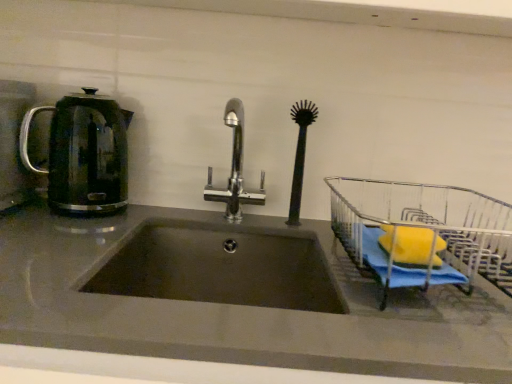
Identify the location of translucent glass kettle at left. The width and height of the screenshot is (512, 384). (83, 154).

Based on the photo, measure the distance between chrome metallic faucet at center and camera.

A distance of 38.13 inches exists between chrome metallic faucet at center and camera.

Image resolution: width=512 pixels, height=384 pixels. Describe the element at coordinates (234, 170) in the screenshot. I see `chrome metallic faucet at center` at that location.

The width and height of the screenshot is (512, 384). Describe the element at coordinates (300, 155) in the screenshot. I see `black rubber brush at center` at that location.

The image size is (512, 384). I want to click on translucent glass kettle at left, so click(x=83, y=154).

Consider the image. Is black rubber brush at center positioned before metallic wire dish rack at right?

No, the depth of black rubber brush at center is greater than that of metallic wire dish rack at right.

Is black rubber brush at center looking in the opposite direction of metallic wire dish rack at right?

black rubber brush at center is not turned away from metallic wire dish rack at right.

From the image's perspective, between black rubber brush at center and metallic wire dish rack at right, which one is located above?

black rubber brush at center is shown above in the image.

From a real-world perspective, is black rubber brush at center over metallic wire dish rack at right?

Yes, from a real-world perspective, black rubber brush at center is above metallic wire dish rack at right.

Is dark gray matte sink at center next to chrome metallic faucet at center?

They are not placed beside each other.

Is dark gray matte sink at center surrounding chrome metallic faucet at center?

Definitely not — chrome metallic faucet at center is not inside dark gray matte sink at center.

From the image's perspective, which object appears higher, dark gray matte sink at center or chrome metallic faucet at center?

chrome metallic faucet at center, from the image's perspective.

Does dark gray matte sink at center have a greater width compared to chrome metallic faucet at center?

Indeed, dark gray matte sink at center has a greater width compared to chrome metallic faucet at center.

Does point (304, 157) lie in front of point (95, 93)?

No, (304, 157) is further to viewer.

From the image's perspective, who appears lower, black rubber brush at center or translucent glass kettle at left?

black rubber brush at center, from the image's perspective.

Identify the location of brush that is behind the translucent glass kettle at left. (300, 155).

Looking at this image, is black rubber brush at center wider or thinner than translucent glass kettle at left?

Clearly, black rubber brush at center has less width compared to translucent glass kettle at left.

In the scene shown: How many degrees apart are the facing directions of chrome metallic faucet at center and translucent glass kettle at left?

The facing directions of chrome metallic faucet at center and translucent glass kettle at left are 3.09 degrees apart.

Is chrome metallic faucet at center taller than translucent glass kettle at left?

Correct, chrome metallic faucet at center is much taller as translucent glass kettle at left.

Is translucent glass kettle at left at the back of chrome metallic faucet at center?

chrome metallic faucet at center is not turned away from translucent glass kettle at left.

From a real-world perspective, is chrome metallic faucet at center beneath translucent glass kettle at left?

Correct, in the physical world, chrome metallic faucet at center is lower than translucent glass kettle at left.

Is translucent glass kettle at left directly adjacent to black rubber brush at center?

No, translucent glass kettle at left is not in contact with black rubber brush at center.

Based on the photo, between translucent glass kettle at left and black rubber brush at center, which one has larger size?

translucent glass kettle at left.

Is translucent glass kettle at left aimed at black rubber brush at center?

No, translucent glass kettle at left is not aimed at black rubber brush at center.

Between point (92, 157) and point (297, 109), which one is positioned in front?

Positioned in front is point (297, 109).

Is chrome metallic faucet at center with metallic wire dish rack at right?

They are not placed beside each other.

Does chrome metallic faucet at center appear on the right side of metallic wire dish rack at right?

No.

From the image's perspective, which is above, chrome metallic faucet at center or metallic wire dish rack at right?

chrome metallic faucet at center, from the image's perspective.

This screenshot has height=384, width=512. What are the coordinates of `tap behind the metallic wire dish rack at right` in the screenshot? It's located at (234, 170).

Can you confirm if dark gray matte sink at center is positioned to the right of black rubber brush at center?

In fact, dark gray matte sink at center is to the left of black rubber brush at center.

Between point (215, 231) and point (290, 222), which one is positioned in front?

The point (215, 231) is more forward.

Would you consider dark gray matte sink at center to be distant from black rubber brush at center?

They are positioned close to each other.

Looking at this image, from the image's perspective, which is below, dark gray matte sink at center or black rubber brush at center?

From the image's view, dark gray matte sink at center is below.

The height and width of the screenshot is (384, 512). I want to click on cart that is on the right side of black rubber brush at center, so click(423, 232).

This screenshot has height=384, width=512. I want to click on sink lying below the chrome metallic faucet at center (from the image's perspective), so click(220, 266).

From the image, which object appears to be farther from black rubber brush at center, dark gray matte sink at center or chrome metallic faucet at center?

Based on the image, dark gray matte sink at center appears to be further to black rubber brush at center.

Estimate the real-world distances between objects in this image. Which object is closer to metallic wire dish rack at right, dark gray matte sink at center or translucent glass kettle at left?

The object closer to metallic wire dish rack at right is dark gray matte sink at center.

Looking at the image, which one is located closer to translucent glass kettle at left, metallic wire dish rack at right or dark gray matte sink at center?

dark gray matte sink at center is closer to translucent glass kettle at left.

Based on their spatial positions, is black rubber brush at center or metallic wire dish rack at right further from translucent glass kettle at left?

metallic wire dish rack at right is further to translucent glass kettle at left.

Estimate the real-world distances between objects in this image. Which object is closer to translucent glass kettle at left, dark gray matte sink at center or metallic wire dish rack at right?

dark gray matte sink at center is closer to translucent glass kettle at left.

When comparing their distances from dark gray matte sink at center, does translucent glass kettle at left or black rubber brush at center seem closer?

black rubber brush at center is positioned closer to the anchor dark gray matte sink at center.

Estimate the real-world distances between objects in this image. Which object is further from dark gray matte sink at center, metallic wire dish rack at right or chrome metallic faucet at center?

metallic wire dish rack at right is positioned further to the anchor dark gray matte sink at center.

Considering their positions, is black rubber brush at center positioned further to chrome metallic faucet at center than metallic wire dish rack at right?

metallic wire dish rack at right is positioned further to the anchor chrome metallic faucet at center.

The height and width of the screenshot is (384, 512). In order to click on sink situated between translucent glass kettle at left and black rubber brush at center from left to right in this screenshot , I will do `click(220, 266)`.

In order to click on sink situated between translucent glass kettle at left and metallic wire dish rack at right from left to right in this screenshot , I will do `click(220, 266)`.

At what (x,y) coordinates should I click in order to perform the action: click on sink between translucent glass kettle at left and chrome metallic faucet at center from left to right. Please return your answer as a coordinate pair (x, y). The image size is (512, 384). Looking at the image, I should click on (220, 266).

Find the location of a particular element. brush between chrome metallic faucet at center and metallic wire dish rack at right in the horizontal direction is located at coordinates [x=300, y=155].